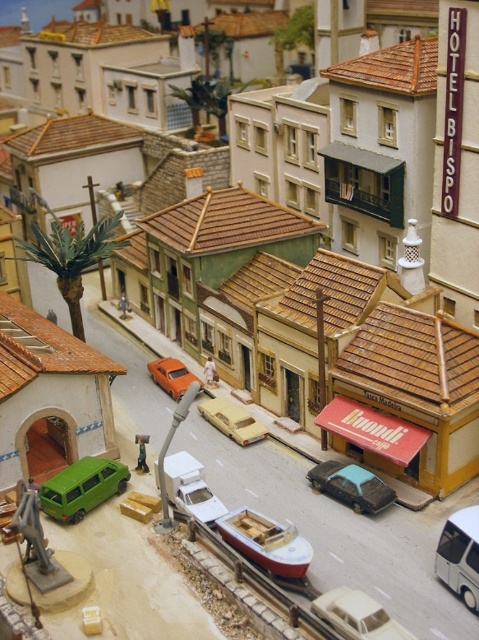
You are a delivery driver who needs to park your vehicle in this miniature town scene. Your truck is larger than the orange matte car at center. Can you park your truck in the spot currently occupied by the green matte van at lower left?

The green matte van at lower left is bigger than the orange matte car at center. Since your truck is larger than the orange matte car at center, it might still fit in the green matte van at lower left spot, but it depends on the exact size difference between your truck and the van. However, since the van is already bigger than the orange car, there is a possibility that the truck could fit there if the space accommodates its size.

You are standing at the point with coordinates point (266, 541) in the miniature town. What object are you standing on?

You are standing on the red matte boat at center.

You are a delivery robot with a 2.5 meter long package. You need to transport this package through the street between the light beige plastic car at center and the orange matte car at center. Is there enough space for the package to fit through the gap between them?

The distance between the light beige plastic car at center and orange matte car at center is 3.68 meters. Since the package is 2.5 meters long, it can fit through the gap as the space is wider than the package.